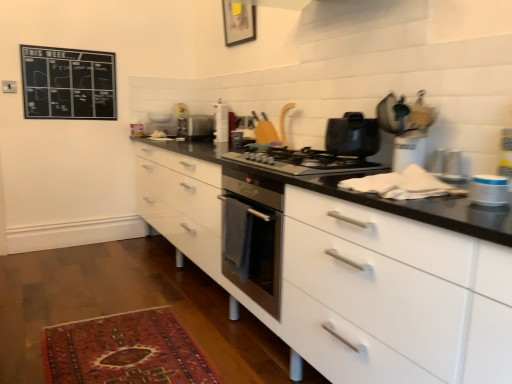
Question: Is white plastic container at right, which is the first appliance in bottom-to-top order, next to shiny black pot at center and touching it?

Choices:
 (A) yes
 (B) no

Answer: (B)

Question: Can you confirm if white plastic container at right, positioned as the 1th appliance in front-to-back order, is wider than shiny black pot at center?

Choices:
 (A) no
 (B) yes

Answer: (A)

Question: Does white plastic container at right, which is the first appliance in bottom-to-top order, come in front of shiny black pot at center?

Choices:
 (A) no
 (B) yes

Answer: (B)

Question: Does white plastic container at right, which is the fourth appliance in left-to-right order, have a lesser height compared to shiny black pot at center?

Choices:
 (A) no
 (B) yes

Answer: (B)

Question: Would you consider white plastic container at right, which is the fourth appliance in left-to-right order, to be distant from shiny black pot at center?

Choices:
 (A) no
 (B) yes

Answer: (A)

Question: Is wooden picture frame at upper center inside the boundaries of carpeted rug at lower left, or outside?

Choices:
 (A) outside
 (B) inside

Answer: (A)

Question: Is wooden picture frame at upper center wider or thinner than carpeted rug at lower left?

Choices:
 (A) wide
 (B) thin

Answer: (B)

Question: Is wooden picture frame at upper center bigger or smaller than carpeted rug at lower left?

Choices:
 (A) big
 (B) small

Answer: (B)

Question: Is wooden picture frame at upper center taller or shorter than carpeted rug at lower left?

Choices:
 (A) short
 (B) tall

Answer: (B)

Question: Is satin silver toaster at center, which is counted as the 1th appliance, starting from the top, in front of or behind shiny black pot at center in the image?

Choices:
 (A) behind
 (B) front

Answer: (A)

Question: Is satin silver toaster at center, positioned as the first appliance in back-to-front order, wider or thinner than shiny black pot at center?

Choices:
 (A) wide
 (B) thin

Answer: (A)

Question: From a real-world perspective, is satin silver toaster at center, the 4th appliance in the bottom-to-top sequence, positioned above or below shiny black pot at center?

Choices:
 (A) below
 (B) above

Answer: (A)

Question: Is satin silver toaster at center, which is counted as the 1th appliance, starting from the top, to the left or to the right of shiny black pot at center in the image?

Choices:
 (A) right
 (B) left

Answer: (B)

Question: In the image, is satin black gas stove at center on the left side or the right side of white glossy toaster at center, which is counted as the third appliance, starting from the front?

Choices:
 (A) left
 (B) right

Answer: (B)

Question: Is satin black gas stove at center in front of or behind white glossy toaster at center, which appears as the 3th appliance when viewed from the right, in the image?

Choices:
 (A) front
 (B) behind

Answer: (A)